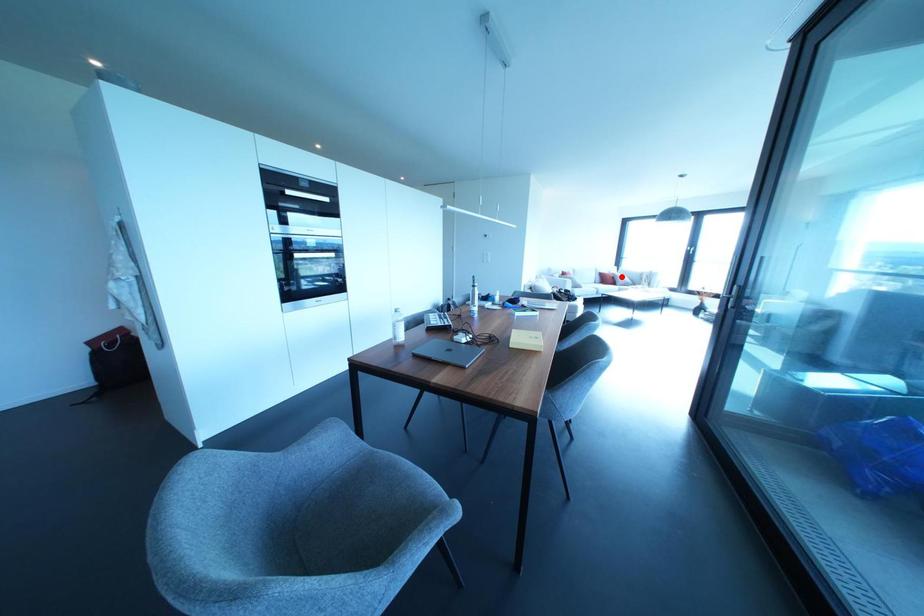
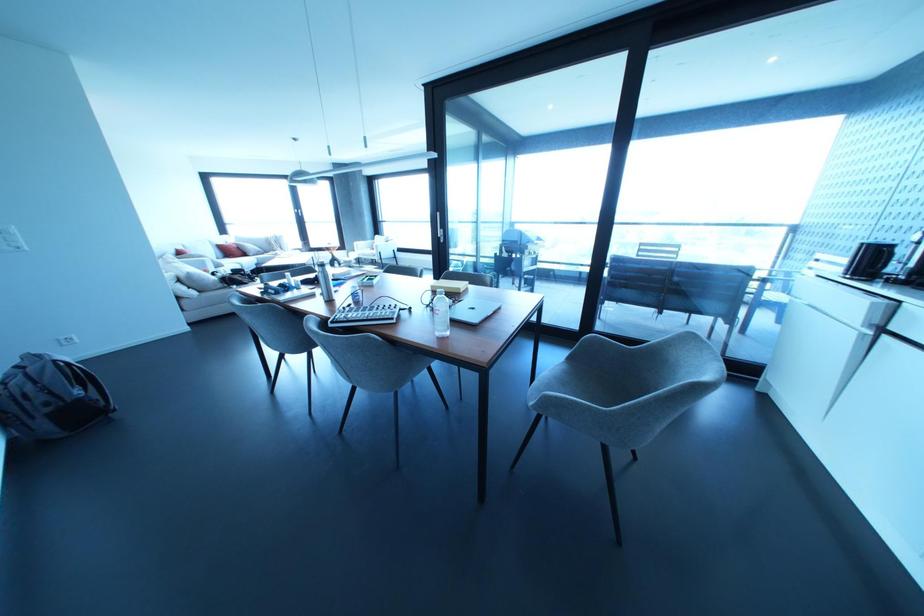
Where in the second image is the point corresponding to the highlighted location from the first image?

(249, 246)